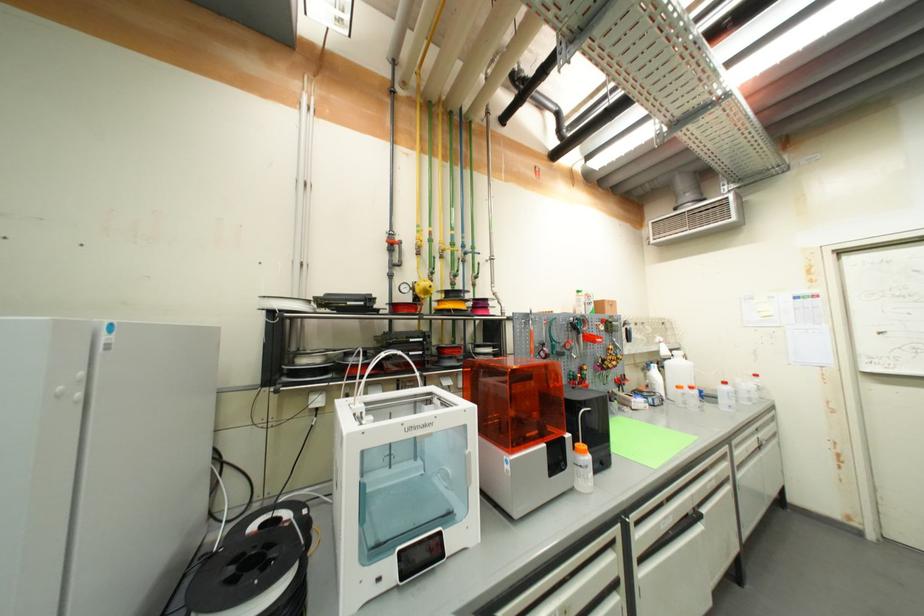
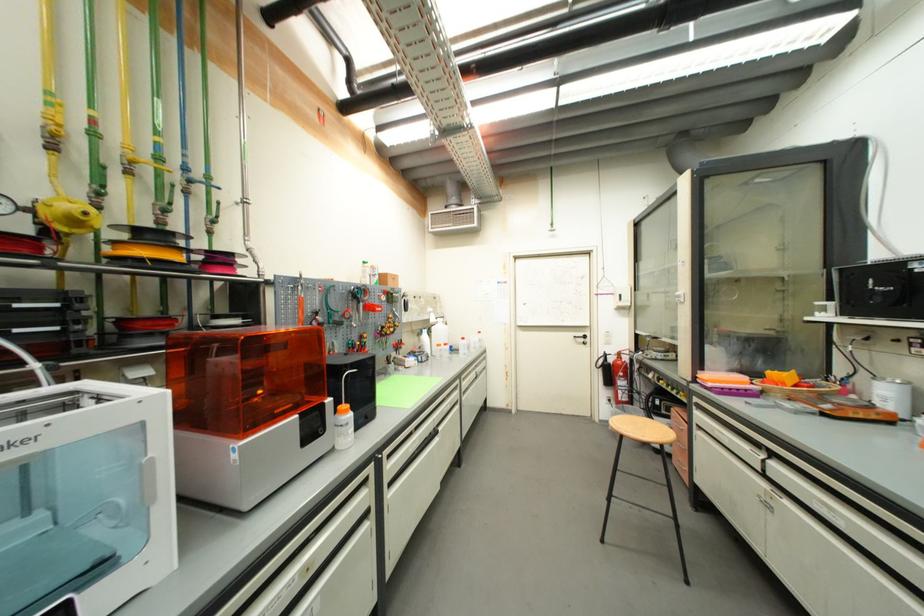
In the second image, find the point that corresponds to the point at 574,438 in the first image.

(334, 402)